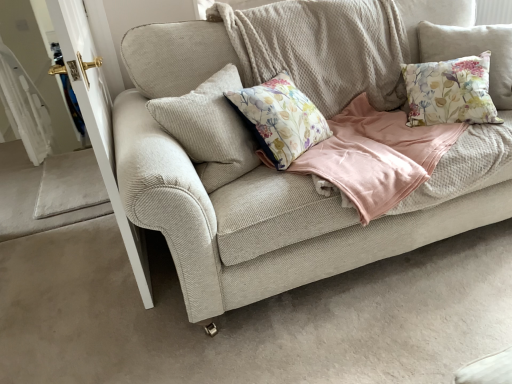
I want to click on vacant area situated to the left side of white glossy door handle at left, so 73,257.